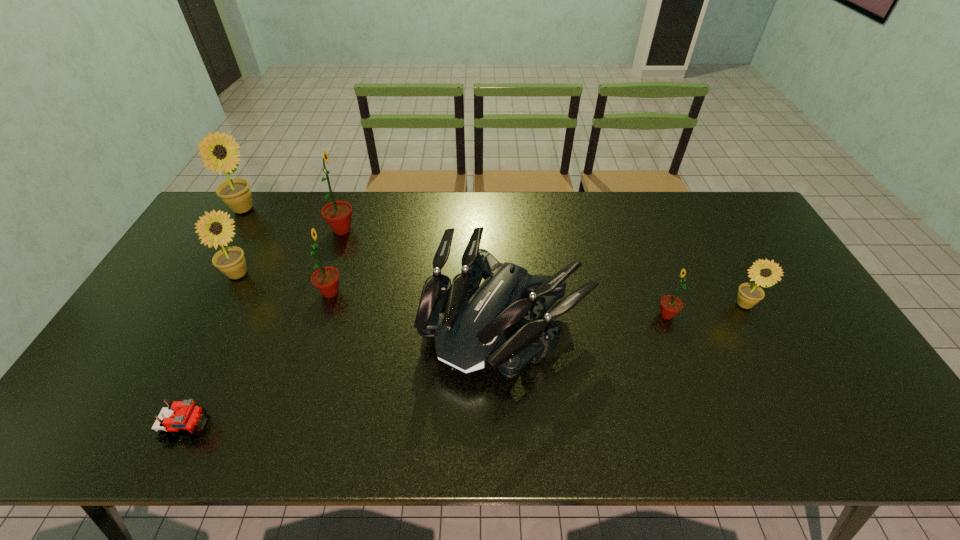
Point out which sunflower is positioned as the fifth nearest to the smallest green sunflower. Please provide its 2D coordinates. Your answer should be formatted as a tuple, i.e. [(x, y)], where the tuple contains the x and y coordinates of a point satisfying the conditions above.

[(235, 193)]

The image size is (960, 540). What are the coordinates of `the third closest yellow sunflower to the red Lego` in the screenshot? It's located at (749, 294).

Where is `the second closest yellow sunflower to the sixth object from left to right`? This screenshot has width=960, height=540. the second closest yellow sunflower to the sixth object from left to right is located at coordinates (230, 260).

Where is `green sunflower that is the closest to the second nearest green sunflower`? This screenshot has width=960, height=540. green sunflower that is the closest to the second nearest green sunflower is located at coordinates (337, 214).

Identify which green sunflower is located as the nearest to the second smallest green sunflower. Please provide its 2D coordinates. Your answer should be formatted as a tuple, i.e. [(x, y)], where the tuple contains the x and y coordinates of a point satisfying the conditions above.

[(337, 214)]

The width and height of the screenshot is (960, 540). I want to click on vacant space that satisfies the following two spatial constraints: 1. on the face of the farthest green sunflower; 2. on the left side of the drone, so click(x=311, y=321).

This screenshot has width=960, height=540. What are the coordinates of `vacant space that satisfies the following two spatial constraints: 1. on the face of the rightmost sunflower; 2. on the face of the rightmost green sunflower` in the screenshot? It's located at click(749, 315).

Find the location of a particular element. The height and width of the screenshot is (540, 960). vacant position in the image that satisfies the following two spatial constraints: 1. on the back side of the drone; 2. on the face of the farthest green sunflower is located at coordinates (501, 230).

The image size is (960, 540). Find the location of `vacant space that satisfies the following two spatial constraints: 1. on the face of the rightmost sunflower; 2. on the face of the second sunflower from right to left`. vacant space that satisfies the following two spatial constraints: 1. on the face of the rightmost sunflower; 2. on the face of the second sunflower from right to left is located at coordinates (749, 315).